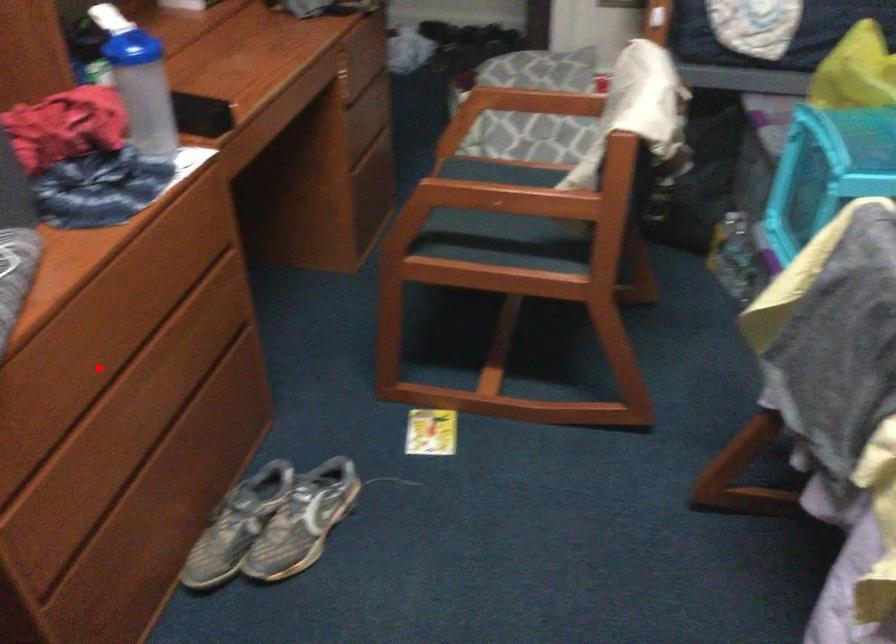
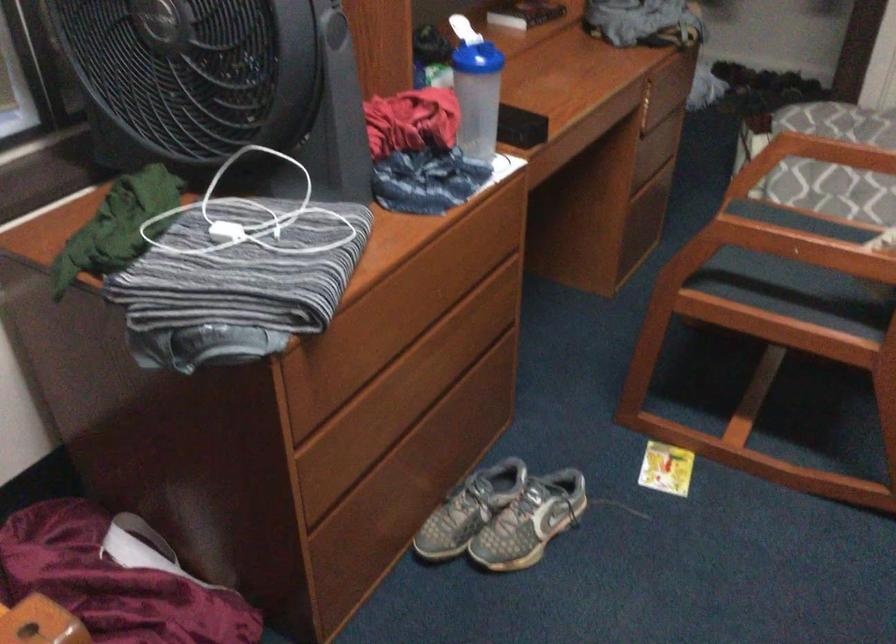
Question: I am providing you with two images of the same scene from different viewpoints. Image1 has a red point marked. In image2, the corresponding 3D location appears at what relative position? Reply with the corresponding letter.

Choices:
 (A) Closer
 (B) Farther

Answer: (B)